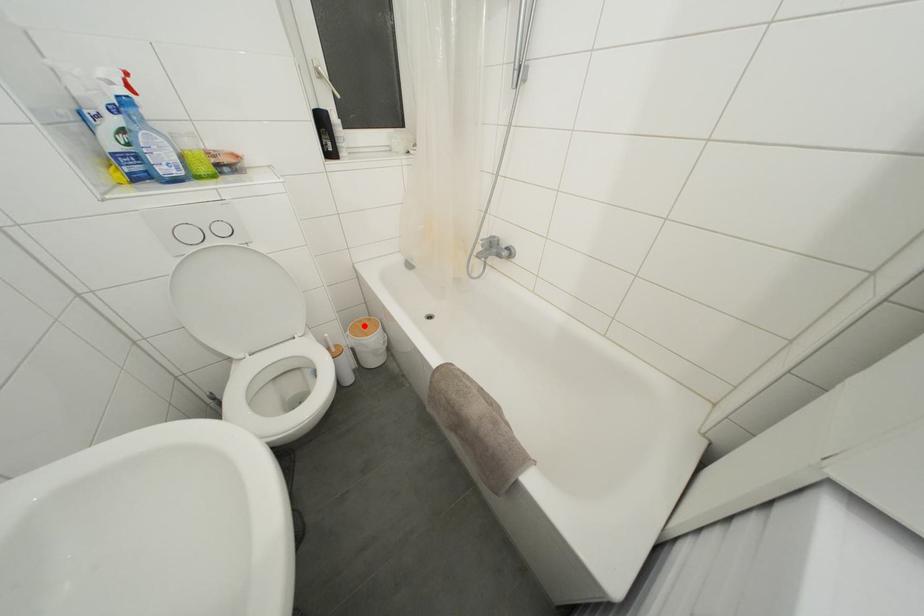
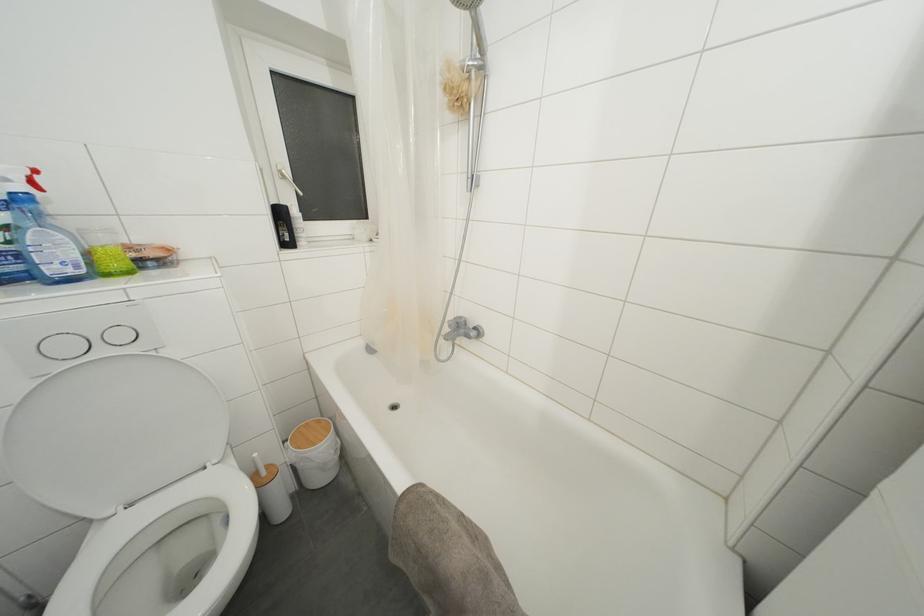
Where in the second image is the point corresponding to the highlighted location from the first image?

(310, 429)